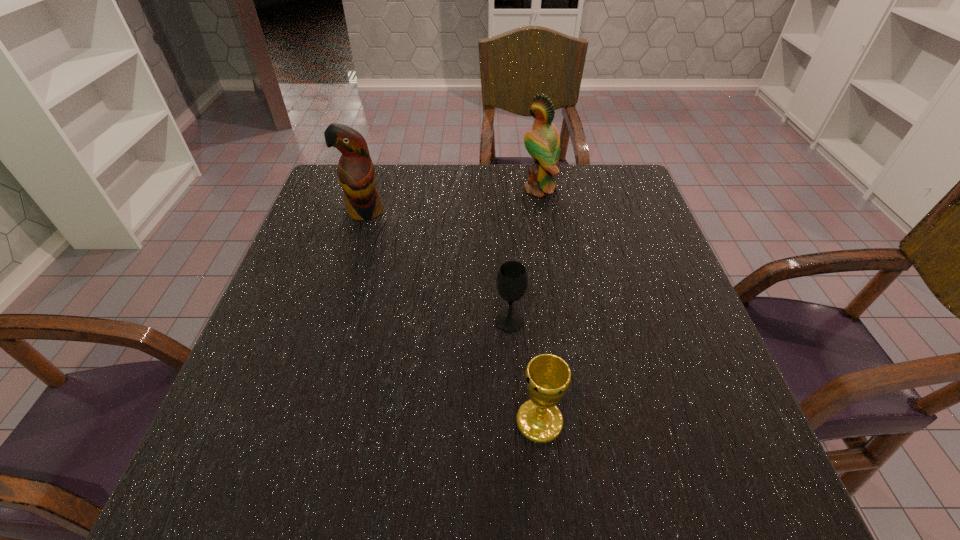
The width and height of the screenshot is (960, 540). I want to click on the right parrot, so click(543, 143).

Identify the location of the left parrot. (356, 174).

Identify the location of chalice. This screenshot has height=540, width=960. (548, 377).

The height and width of the screenshot is (540, 960). I want to click on wineglass, so click(x=512, y=279).

Image resolution: width=960 pixels, height=540 pixels. Find the location of `free spot located 0.210m on the front-facing side of the right parrot`. free spot located 0.210m on the front-facing side of the right parrot is located at coordinates (447, 189).

In order to click on free region located 0.140m on the front-facing side of the right parrot in this screenshot , I will do `click(472, 189)`.

In order to click on vacant space located on the front-facing side of the right parrot in this screenshot , I will do `click(490, 189)`.

Where is `blank space located 0.210m on the face of the left parrot`? blank space located 0.210m on the face of the left parrot is located at coordinates (343, 284).

This screenshot has width=960, height=540. What are the coordinates of `vacant area situated 0.370m on the back of the chalice` in the screenshot? It's located at (523, 260).

Where is `vacant space situated 0.200m on the back of the wineglass`? This screenshot has height=540, width=960. vacant space situated 0.200m on the back of the wineglass is located at coordinates (505, 249).